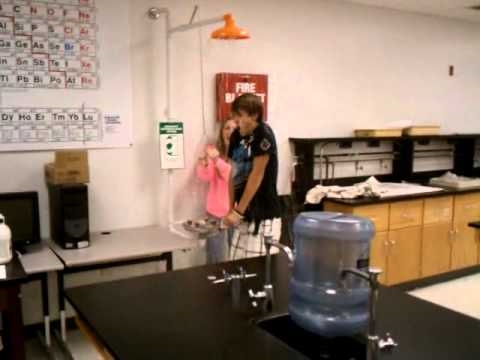
Locate an element on the screen. tables is located at coordinates (169, 316), (160, 230), (43, 260).